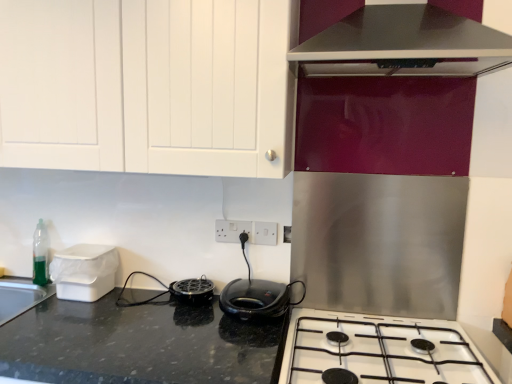
Question: In terms of size, does black glossy range hood at upper right appear bigger or smaller than white glossy gas stove at lower center?

Choices:
 (A) big
 (B) small

Answer: (A)

Question: Considering the positions of black glossy range hood at upper right and white glossy gas stove at lower center in the image, is black glossy range hood at upper right wider or thinner than white glossy gas stove at lower center?

Choices:
 (A) wide
 (B) thin

Answer: (B)

Question: Considering the real-world distances, which object is farthest from the white glossy gas stove at lower center?

Choices:
 (A) white plastic electric outlet at center, the 2th electric outlet when ordered from right to left
 (B) black glossy range hood at upper right
 (C) white plastic electric outlet at center, which ranks as the first electric outlet in right-to-left order
 (D) black matte grill at center, which appears as the 1th kitchen appliance when viewed from the left
 (E) white plastic container at left

Answer: (E)

Question: Estimate the real-world distances between objects in this image. Which object is closer to the black speckled granite at center?

Choices:
 (A) black glossy waffle maker at center, marked as the 2th kitchen appliance in a left-to-right arrangement
 (B) white plastic container at left
 (C) white plastic electric outlet at center, which ranks as the first electric outlet in right-to-left order
 (D) white plastic electric outlet at center, placed as the first electric outlet when sorted from left to right
 (E) black matte grill at center, which appears as the 1th kitchen appliance when viewed from the left

Answer: (A)